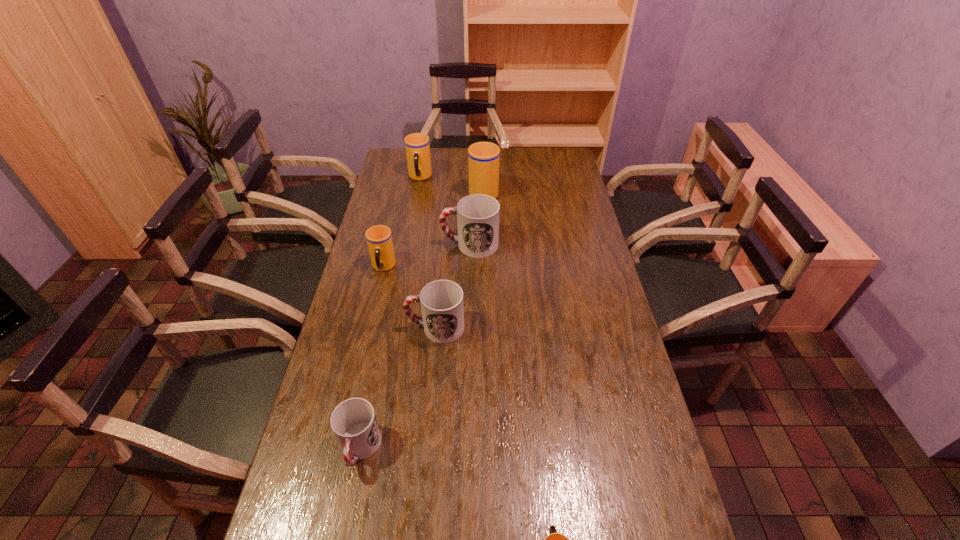
The image size is (960, 540). In order to click on free space located on the side of the tallest cup with the handle in this screenshot , I will do `click(483, 152)`.

Locate an element on the screen. vacant space located 0.280m on the side of the tallest cup with the handle is located at coordinates (483, 150).

Where is `vacant space located on the side of the third smallest beige cup with the handle`? This screenshot has height=540, width=960. vacant space located on the side of the third smallest beige cup with the handle is located at coordinates (408, 241).

Where is `free space located on the handle side of the farthest red cup`? Image resolution: width=960 pixels, height=540 pixels. free space located on the handle side of the farthest red cup is located at coordinates (383, 245).

Image resolution: width=960 pixels, height=540 pixels. I want to click on free space located 0.180m on the handle side of the farthest red cup, so click(x=394, y=245).

In order to click on free location located 0.070m on the handle side of the farthest red cup in this screenshot , I will do `click(422, 245)`.

Find the location of `vacant space located 0.100m on the handle side of the second biggest red cup`. vacant space located 0.100m on the handle side of the second biggest red cup is located at coordinates (374, 327).

Locate an element on the screen. The image size is (960, 540). blank space located 0.130m on the handle side of the second biggest red cup is located at coordinates (365, 327).

At what (x,y) coordinates should I click in order to perform the action: click on free region located 0.090m on the handle side of the second biggest red cup. Please return your answer as a coordinate pair (x, y). The image size is (960, 540). Looking at the image, I should click on (378, 327).

Where is `vacant space located 0.350m on the side of the second smallest beige cup with the handle`? The width and height of the screenshot is (960, 540). vacant space located 0.350m on the side of the second smallest beige cup with the handle is located at coordinates (361, 363).